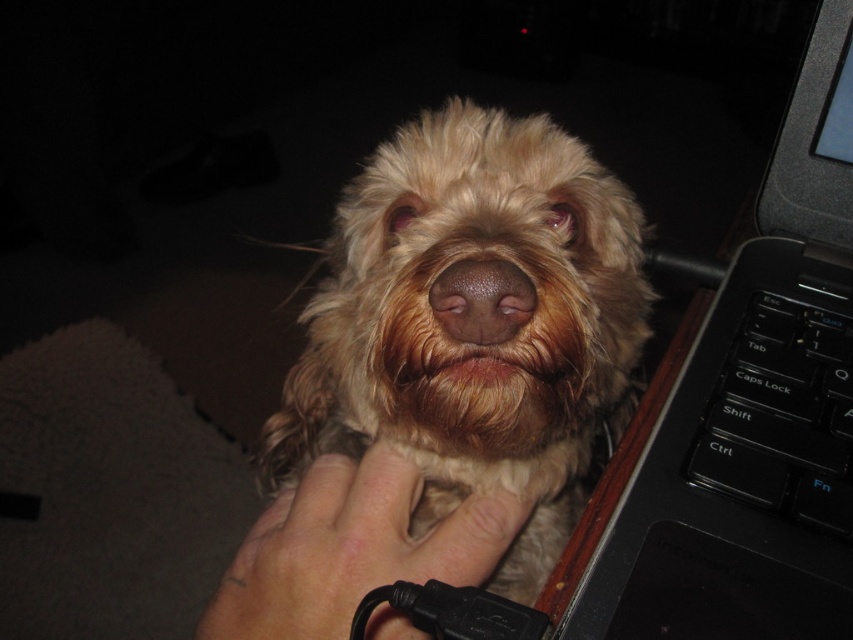
Question: Which point is closer to the camera?

Choices:
 (A) (809, 394)
 (B) (598, 554)
 (C) (503, 449)

Answer: (B)

Question: Where is black plastic laptop at right located in relation to light skin hand at center in the image?

Choices:
 (A) below
 (B) above

Answer: (B)

Question: Can you confirm if light skin hand at center is thinner than black plastic keyboard at right?

Choices:
 (A) yes
 (B) no

Answer: (B)

Question: Which point is closer to the camera taking this photo?

Choices:
 (A) (776, 365)
 (B) (432, 442)
 (C) (535, 292)

Answer: (C)

Question: Is light skin hand at center above black plastic keyboard at right?

Choices:
 (A) yes
 (B) no

Answer: (B)

Question: Estimate the real-world distances between objects in this image. Which object is closer to the brown matte nose at center?

Choices:
 (A) light skin hand at center
 (B) black plastic laptop at right
 (C) fuzzy brown dog at center

Answer: (A)